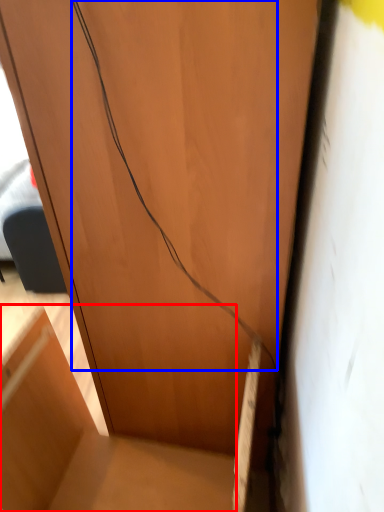
Question: Which object appears closest to the camera in this image, furniture (highlighted by a red box) or wire (highlighted by a blue box)?

Choices:
 (A) furniture
 (B) wire

Answer: (B)